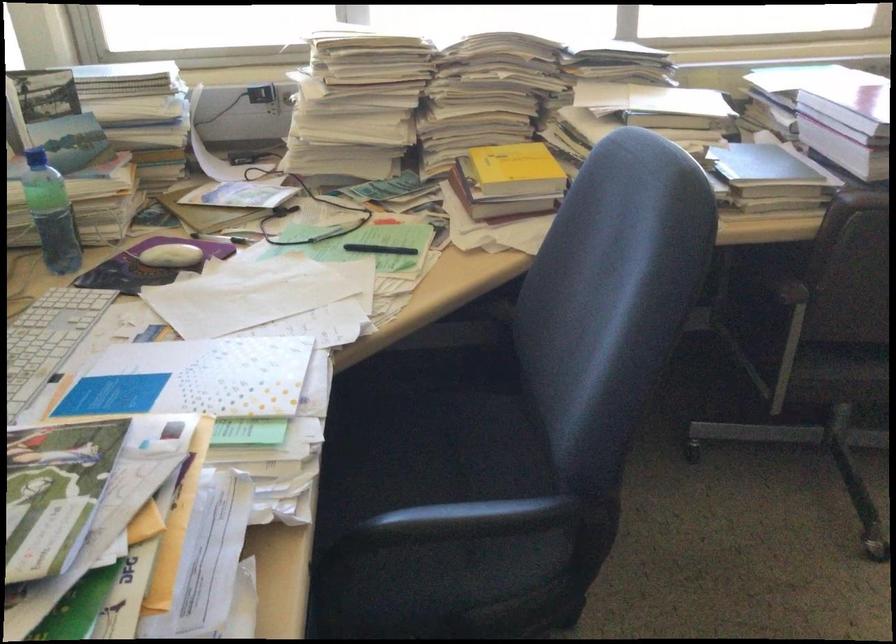
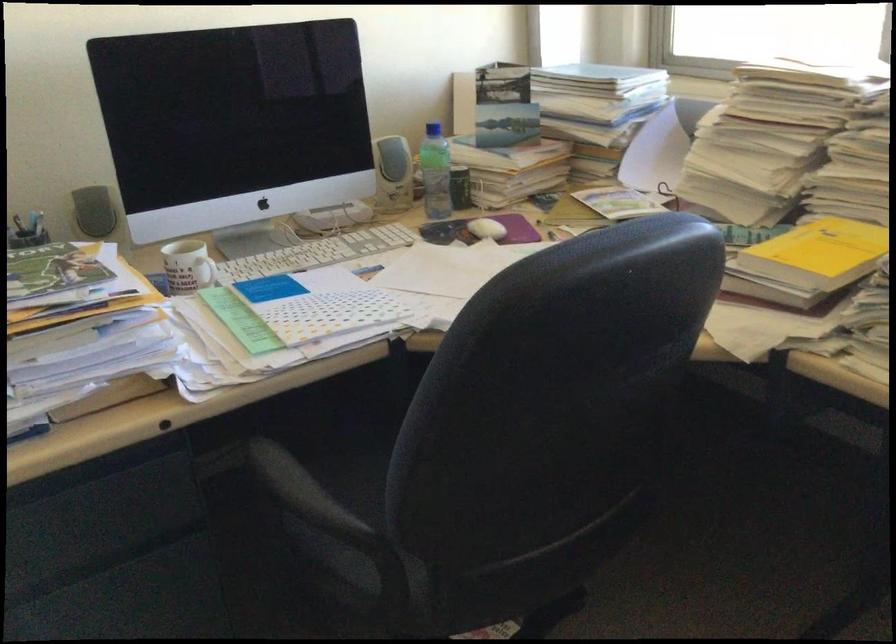
Find the pixel in the second image that matches the point at 188,254 in the first image.

(487, 229)